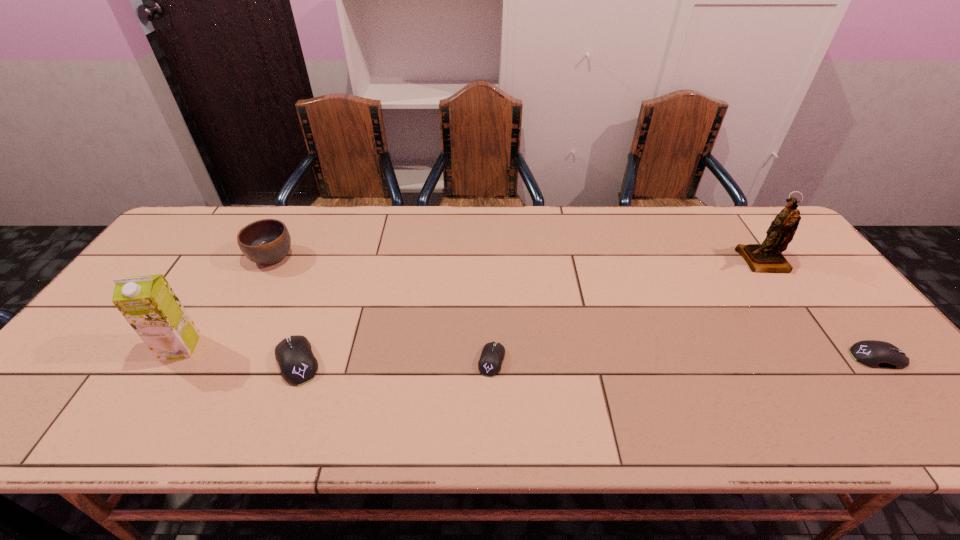
You are a GUI agent. You are given a task and a screenshot of the screen. Output one action in this format:
    pyautogui.click(x=<x>, y=<y>)
    Task: Click on the free space located 0.230m on the back of the second computer equipment from left to right
    This screenshot has height=540, width=960.
    Given the screenshot: What is the action you would take?
    pyautogui.click(x=490, y=280)

At what (x,y) coordinates should I click in order to perform the action: click on vacant region located 0.060m on the left of the second shortest computer equipment. Please return your answer as a coordinate pair (x, y). This screenshot has width=960, height=540. Looking at the image, I should click on (827, 357).

This screenshot has width=960, height=540. What are the coordinates of `blank space located on the left of the bowl` in the screenshot? It's located at (212, 257).

The width and height of the screenshot is (960, 540). In order to click on free location located on the front-facing side of the figurine in this screenshot , I will do 645,261.

Where is `free space located on the front-facing side of the figurine`? free space located on the front-facing side of the figurine is located at coordinates (679, 261).

Locate an element on the screen. The width and height of the screenshot is (960, 540). vacant space located on the front-facing side of the figurine is located at coordinates (692, 261).

The image size is (960, 540). I want to click on vacant region located 0.100m on the right of the soya milk, so click(238, 347).

Where is `bowl that is positioned at the far edge`? Image resolution: width=960 pixels, height=540 pixels. bowl that is positioned at the far edge is located at coordinates (266, 242).

Find the location of a particular element. This screenshot has width=960, height=540. figurine at the far edge is located at coordinates (767, 257).

You are a GUI agent. You are given a task and a screenshot of the screen. Output one action in this format:
    pyautogui.click(x=<x>, y=<y>)
    Task: Click on the computer equipment that is at the right edge
    The height and width of the screenshot is (540, 960).
    Given the screenshot: What is the action you would take?
    pos(876,354)